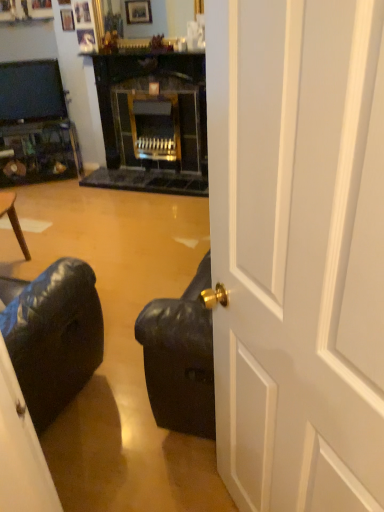
Question: Is white glossy door at center taller or shorter than matte black television at upper left?

Choices:
 (A) short
 (B) tall

Answer: (B)

Question: From a real-world perspective, is white glossy door at center physically located above or below matte black television at upper left?

Choices:
 (A) below
 (B) above

Answer: (A)

Question: Is point (374, 343) positioned closer to the camera than point (1, 119)?

Choices:
 (A) closer
 (B) farther

Answer: (A)

Question: Do you think matte black television at upper left is within white glossy door at center, or outside of it?

Choices:
 (A) outside
 (B) inside

Answer: (A)

Question: Looking at their shapes, would you say matte black television at upper left is wider or thinner than white glossy door at center?

Choices:
 (A) thin
 (B) wide

Answer: (A)

Question: Considering the positions of point (14, 103) and point (301, 266), is point (14, 103) closer or farther from the camera than point (301, 266)?

Choices:
 (A) closer
 (B) farther

Answer: (B)

Question: Is matte black television at upper left to the left or to the right of white glossy door at center in the image?

Choices:
 (A) right
 (B) left

Answer: (B)